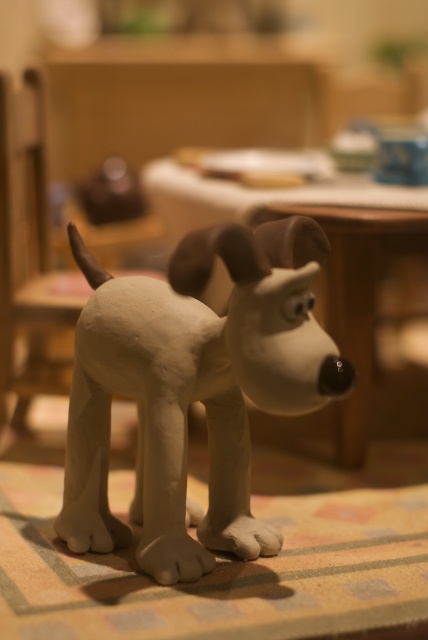
You are a photographer standing 30 inches away from a white matte dog at center in a studio. You want to take a closeup shot of the dog sculpture. Is the current distance sufficient for a clear closeup?

The white matte dog at center is 26.21 inches away from the viewer. Since you are standing 30 inches away, you are slightly farther than the actual distance, so you need to move 3.79 inches closer to achieve the clear closeup.